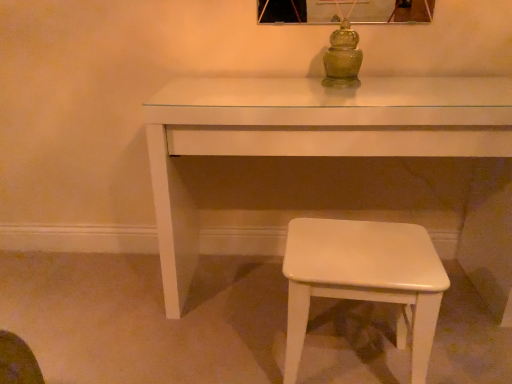
This screenshot has height=384, width=512. I want to click on vacant space in front of green glass jar at center, so click(345, 96).